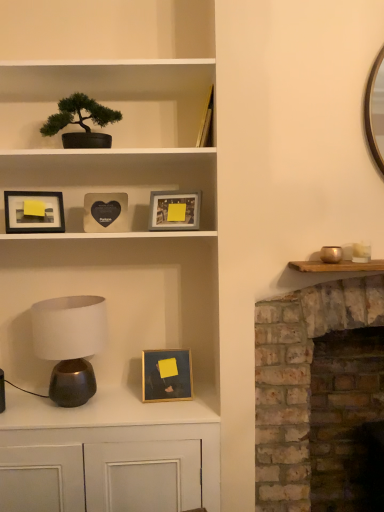
This screenshot has width=384, height=512. I want to click on vacant space to the right of gold/glossy picture frame at center, the 4th picture frame in the top-to-bottom sequence, so click(197, 401).